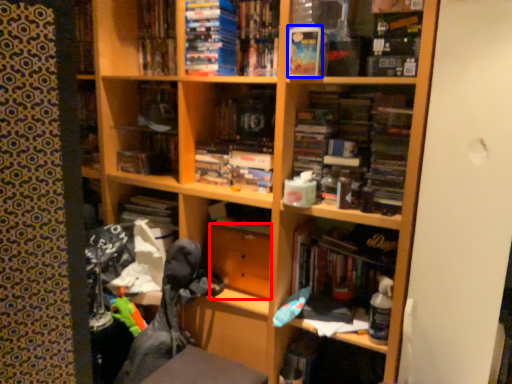
Question: Which object is further to the camera taking this photo, drawer (highlighted by a red box) or paperback book (highlighted by a blue box)?

Choices:
 (A) drawer
 (B) paperback book

Answer: (A)